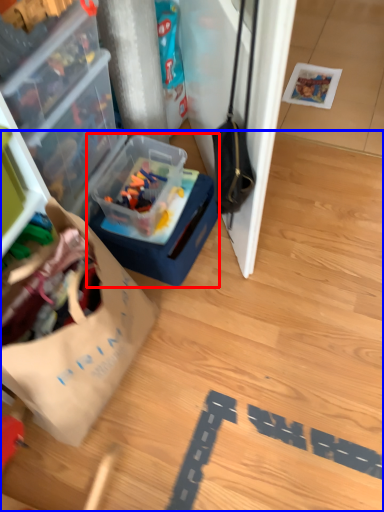
Question: Which of the following is the farthest to the observer, box (highlighted by a red box) or wood (highlighted by a blue box)?

Choices:
 (A) box
 (B) wood

Answer: (A)